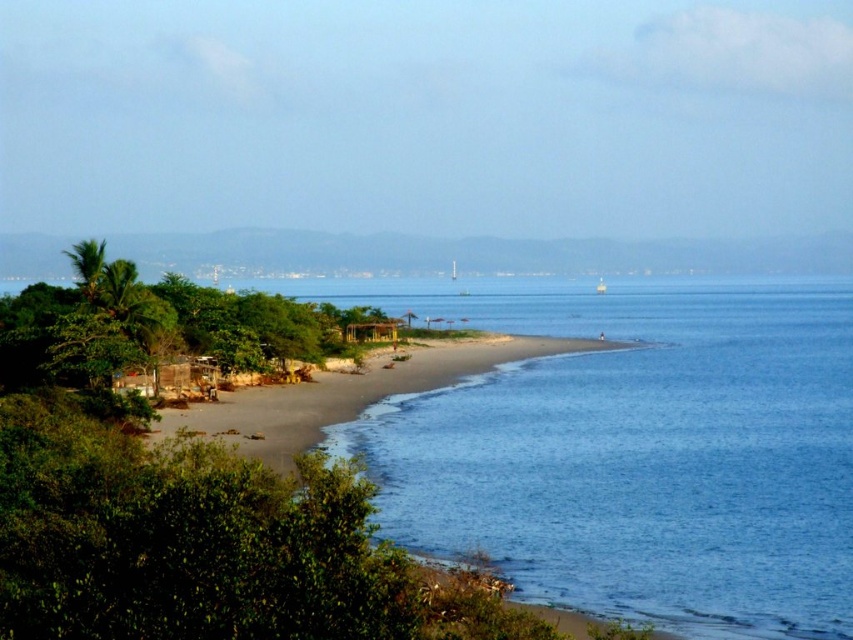
Question: From the image, what is the correct spatial relationship of blue smooth water at center in relation to brown sandy beach at lower left?

Choices:
 (A) above
 (B) below

Answer: (A)

Question: Among these points, which one is farthest from the camera?

Choices:
 (A) (604, 284)
 (B) (379, 381)
 (C) (717, 436)

Answer: (A)

Question: Which object is farther from the camera taking this photo?

Choices:
 (A) blue smooth water at center
 (B) brown sandy beach at lower left
 (C) white plastic boat at center

Answer: (C)

Question: Does brown sandy beach at lower left appear over white plastic boat at center?

Choices:
 (A) yes
 (B) no

Answer: (B)

Question: Considering the real-world distances, which object is closest to the brown sandy beach at lower left?

Choices:
 (A) white plastic boat at center
 (B) blue smooth water at center

Answer: (B)

Question: Can you confirm if blue smooth water at center is wider than white plastic boat at center?

Choices:
 (A) yes
 (B) no

Answer: (A)